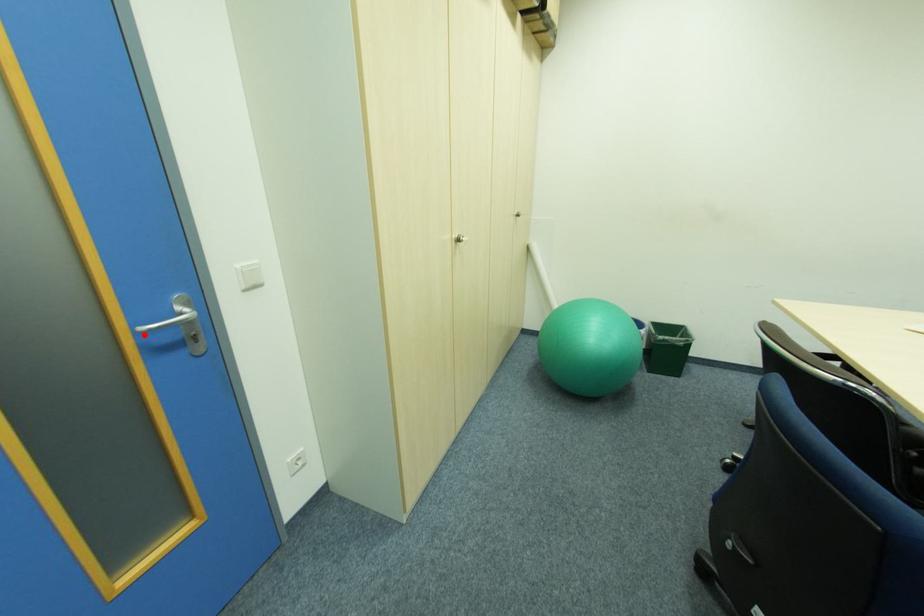
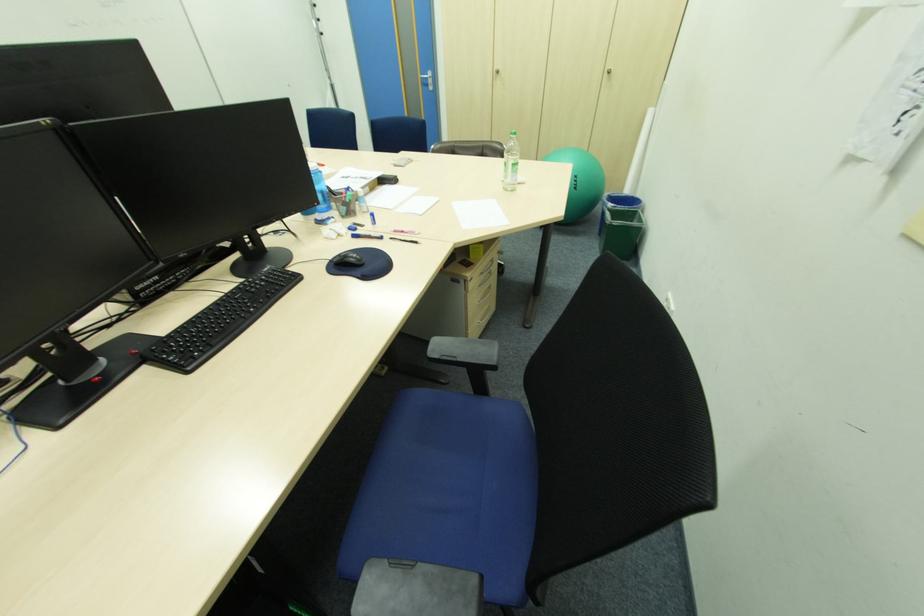
Where in the second image is the point corresponding to the highlighted location from the first image?

(428, 79)